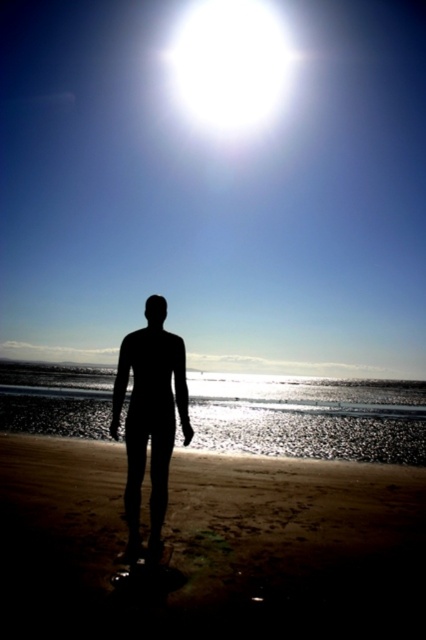
Question: Can you confirm if brown sandy beach at lower center is thinner than black matte figure at center?

Choices:
 (A) yes
 (B) no

Answer: (B)

Question: Which of the following is the farthest from the observer?

Choices:
 (A) click(77, 534)
 (B) click(149, 568)
 (C) click(180, 337)

Answer: (A)

Question: Is brown sandy beach at lower center in front of transparent plastic surfboard at lower center?

Choices:
 (A) yes
 (B) no

Answer: (A)

Question: Which object appears farthest from the camera in this image?

Choices:
 (A) transparent plastic surfboard at lower center
 (B) black matte figure at center
 (C) brown sandy beach at lower center

Answer: (B)

Question: Among these objects, which one is nearest to the camera?

Choices:
 (A) black matte figure at center
 (B) transparent plastic surfboard at lower center
 (C) brown sandy beach at lower center

Answer: (C)

Question: Does brown sandy beach at lower center have a greater width compared to black matte figure at center?

Choices:
 (A) no
 (B) yes

Answer: (B)